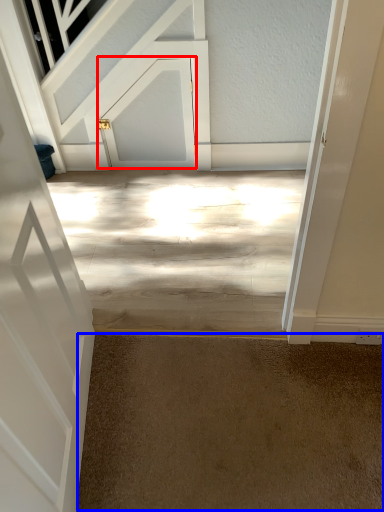
Question: Which object is further to the camera taking this photo, door (highlighted by a red box) or concrete (highlighted by a blue box)?

Choices:
 (A) door
 (B) concrete

Answer: (A)